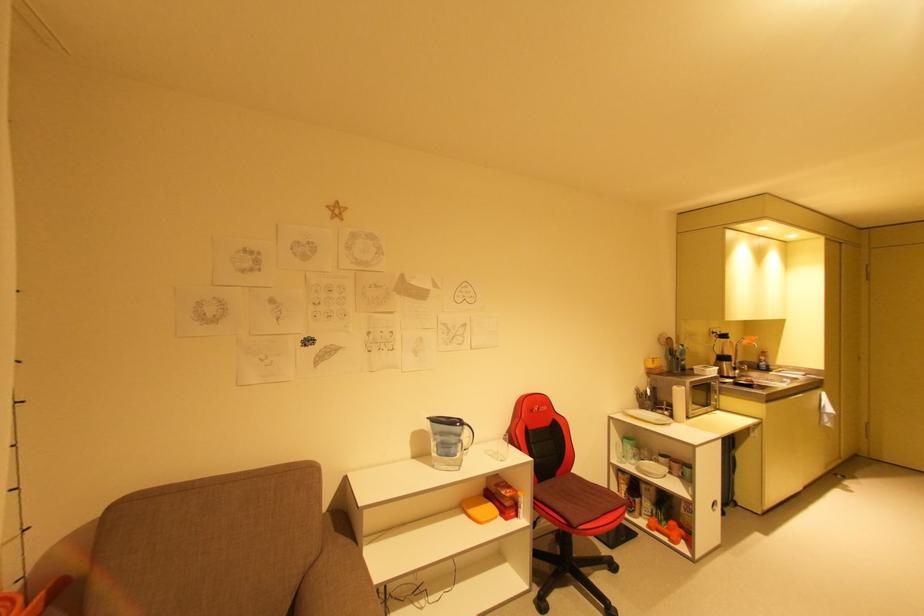
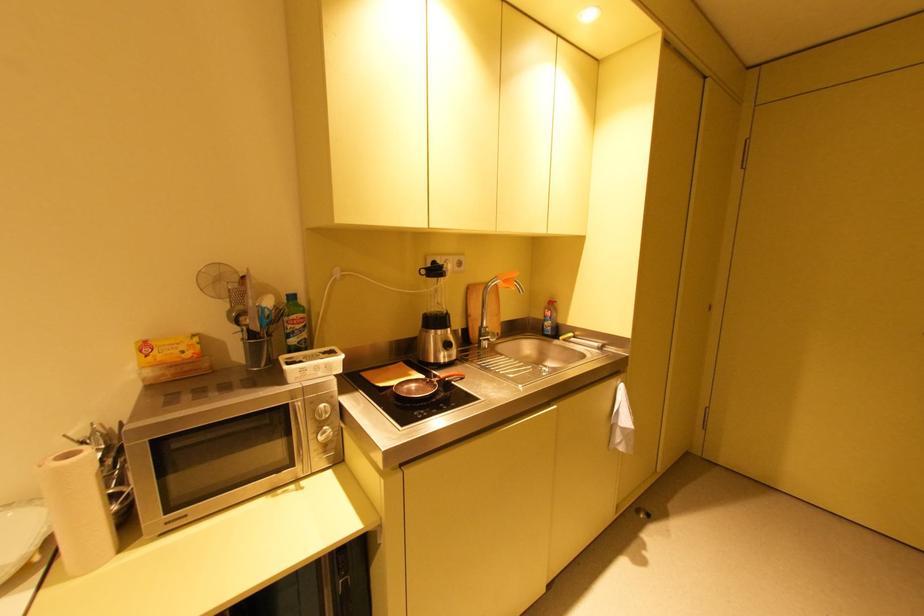
Where in the second image is the point corresponding to (756,341) from the first image?

(508, 282)